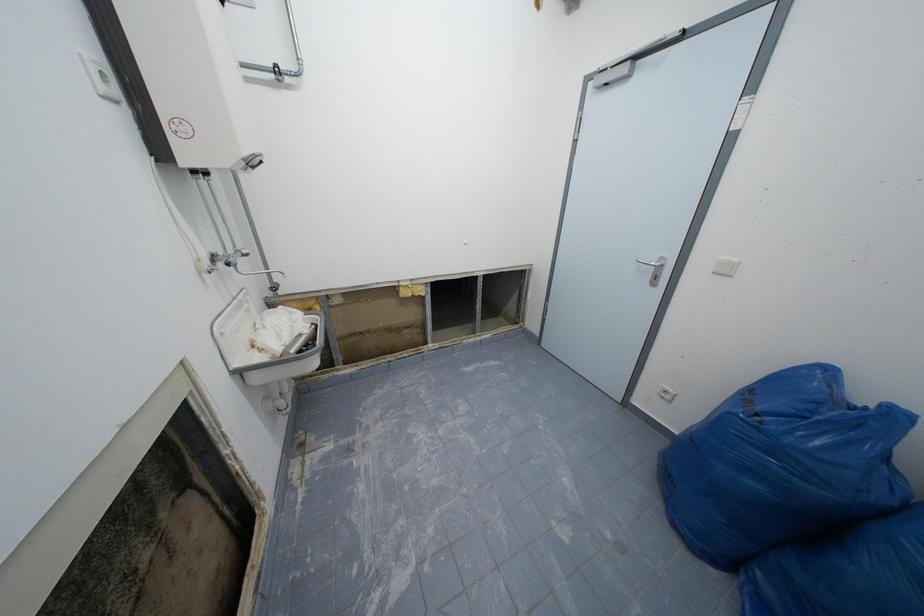
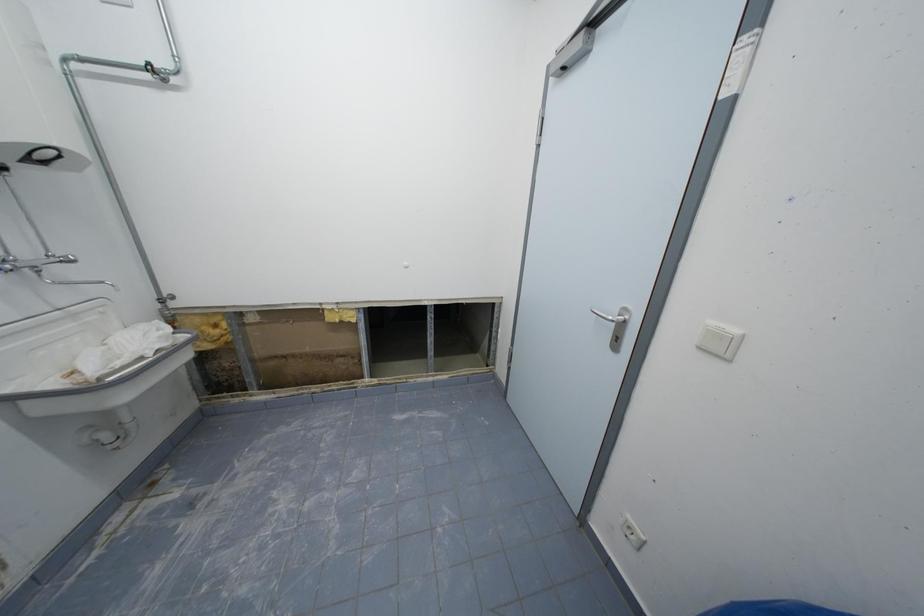
What movement of the cameraman would produce the second image?

The movement direction of the cameraman is right, forward.